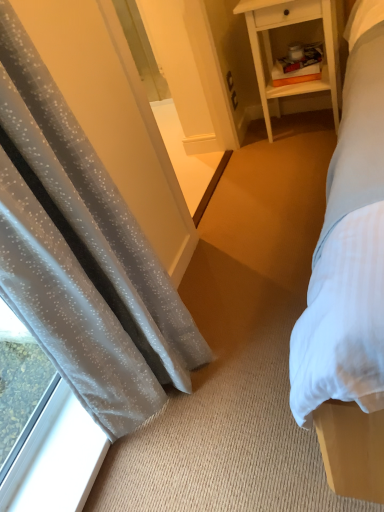
Question: From the image's perspective, is white wood nightstand at upper right under transparent glass window at lower left?

Choices:
 (A) no
 (B) yes

Answer: (A)

Question: Can you confirm if white wood nightstand at upper right is positioned to the right of transparent glass window at lower left?

Choices:
 (A) no
 (B) yes

Answer: (B)

Question: Does white wood nightstand at upper right have a smaller size compared to transparent glass window at lower left?

Choices:
 (A) no
 (B) yes

Answer: (A)

Question: Is white wood nightstand at upper right in front of transparent glass window at lower left?

Choices:
 (A) no
 (B) yes

Answer: (A)

Question: From a real-world perspective, is white wood nightstand at upper right below transparent glass window at lower left?

Choices:
 (A) yes
 (B) no

Answer: (B)

Question: Does white wood nightstand at upper right come behind transparent glass window at lower left?

Choices:
 (A) no
 (B) yes

Answer: (B)

Question: Is translucent gray curtain at left oriented away from white wood nightstand at upper right?

Choices:
 (A) yes
 (B) no

Answer: (B)

Question: Is white wood nightstand at upper right located within translucent gray curtain at left?

Choices:
 (A) no
 (B) yes

Answer: (A)

Question: Can you see translucent gray curtain at left touching white wood nightstand at upper right?

Choices:
 (A) yes
 (B) no

Answer: (B)

Question: Is translucent gray curtain at left positioned in front of white wood nightstand at upper right?

Choices:
 (A) yes
 (B) no

Answer: (A)

Question: From a real-world perspective, is translucent gray curtain at left below white wood nightstand at upper right?

Choices:
 (A) no
 (B) yes

Answer: (A)

Question: Does translucent gray curtain at left have a greater height compared to white wood nightstand at upper right?

Choices:
 (A) no
 (B) yes

Answer: (B)

Question: Is transparent glass window at lower left not inside translucent gray curtain at left?

Choices:
 (A) no
 (B) yes

Answer: (B)